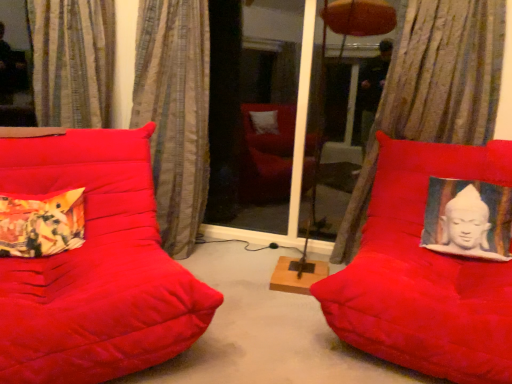
Question: Considering the positions of textured beige curtain at upper right, which is the 1th curtain in right-to-left order, and floral fabric cushion at left in the image, is textured beige curtain at upper right, which is the 1th curtain in right-to-left order, bigger or smaller than floral fabric cushion at left?

Choices:
 (A) small
 (B) big

Answer: (B)

Question: From their relative heights in the image, would you say textured beige curtain at upper right, positioned as the 3th curtain in left-to-right order, is taller or shorter than floral fabric cushion at left?

Choices:
 (A) short
 (B) tall

Answer: (B)

Question: Which is farther from the suede red cushion at right, the first furniture viewed from the right?

Choices:
 (A) textured beige curtain at left, which is the 2th curtain in left-to-right order
 (B) transparent glass screen door at center
 (C) matte red cushion at left, which is the 2th furniture from right to left
 (D) striped fabric curtain at upper left, the 1th curtain positioned from the left
 (E) textured beige curtain at upper right, which is the 1th curtain in right-to-left order

Answer: (D)

Question: Estimate the real-world distances between objects in this image. Which object is farther from the textured beige curtain at upper right, positioned as the 3th curtain in left-to-right order?

Choices:
 (A) matte red cushion at left, which is the 2th furniture from right to left
 (B) striped fabric curtain at upper left, the 1th curtain positioned from the left
 (C) transparent glass screen door at center
 (D) textured beige curtain at left, which is counted as the second curtain, starting from the right
 (E) suede red cushion at right, positioned as the 2th furniture in left-to-right order

Answer: (B)